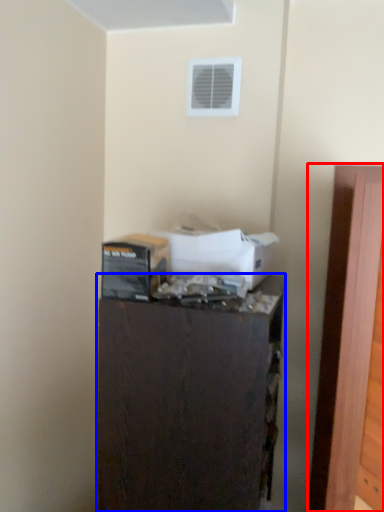
Question: Which object is closer to the camera taking this photo, door (highlighted by a red box) or furniture (highlighted by a blue box)?

Choices:
 (A) door
 (B) furniture

Answer: (A)